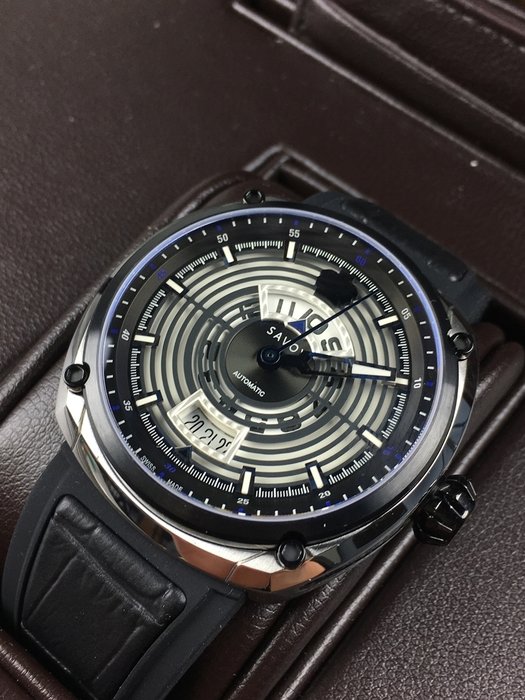
I want to click on screws, so click(77, 372), click(295, 560), click(459, 348), click(254, 192).